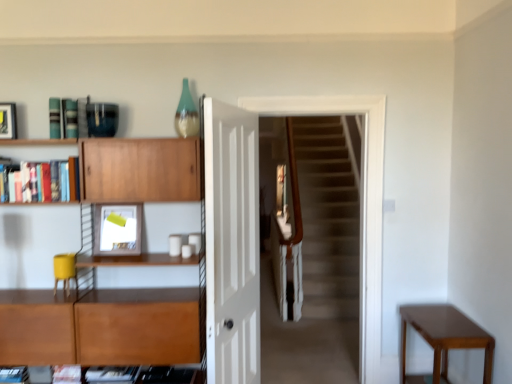
Question: From a real-world perspective, is white glossy door at center physically below matte white picture frame at upper left, the second picture frame positioned from the left?

Choices:
 (A) yes
 (B) no

Answer: (A)

Question: Is white glossy door at center positioned before matte white picture frame at upper left, positioned as the 2th picture frame in top-to-bottom order?

Choices:
 (A) yes
 (B) no

Answer: (A)

Question: Is matte white picture frame at upper left, marked as the 1th picture frame in a bottom-to-top arrangement, at the back of white glossy door at center?

Choices:
 (A) no
 (B) yes

Answer: (B)

Question: Is white glossy door at center completely or partially outside of matte white picture frame at upper left, marked as the 1th picture frame in a bottom-to-top arrangement?

Choices:
 (A) no
 (B) yes

Answer: (B)

Question: From the image's perspective, is white glossy door at center on matte white picture frame at upper left, the second picture frame positioned from the left?

Choices:
 (A) no
 (B) yes

Answer: (A)

Question: Considering the relative sizes of white glossy door at center and matte white picture frame at upper left, which is counted as the first picture frame, starting from the right, in the image provided, is white glossy door at center bigger than matte white picture frame at upper left, which is counted as the first picture frame, starting from the right,?

Choices:
 (A) yes
 (B) no

Answer: (A)

Question: Is carpeted stairs at center positioned in front of wooden cabinet at left, which is the second shelf in top-to-bottom order?

Choices:
 (A) no
 (B) yes

Answer: (A)

Question: Is carpeted stairs at center with wooden cabinet at left, which is the second shelf in top-to-bottom order?

Choices:
 (A) no
 (B) yes

Answer: (A)

Question: Is carpeted stairs at center bigger than wooden cabinet at left, which is the second shelf in top-to-bottom order?

Choices:
 (A) no
 (B) yes

Answer: (A)

Question: Is wooden cabinet at left, the first shelf ordered from the bottom, surrounded by carpeted stairs at center?

Choices:
 (A) no
 (B) yes

Answer: (A)

Question: Is carpeted stairs at center facing away from wooden cabinet at left, which is the second shelf in top-to-bottom order?

Choices:
 (A) no
 (B) yes

Answer: (A)

Question: From a real-world perspective, is carpeted stairs at center located beneath wooden cabinet at left, which is the second shelf in top-to-bottom order?

Choices:
 (A) no
 (B) yes

Answer: (A)

Question: Can you confirm if wooden bookshelf at upper left, which is the 1th shelf in top-to-bottom order, is wider than wooden cabinet at left, which is the second shelf in top-to-bottom order?

Choices:
 (A) no
 (B) yes

Answer: (A)